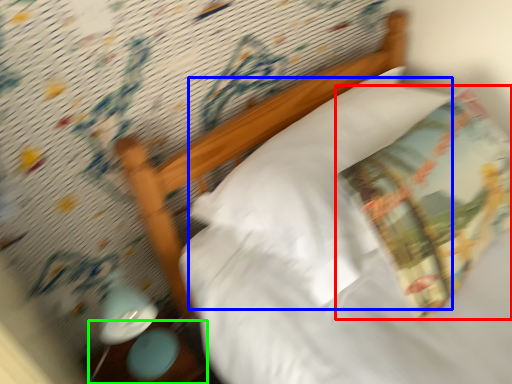
Question: Estimate the real-world distances between objects in this image. Which object is closer to throw pillow (highlighted by a red box), pillow (highlighted by a blue box) or table (highlighted by a green box)?

Choices:
 (A) pillow
 (B) table

Answer: (A)